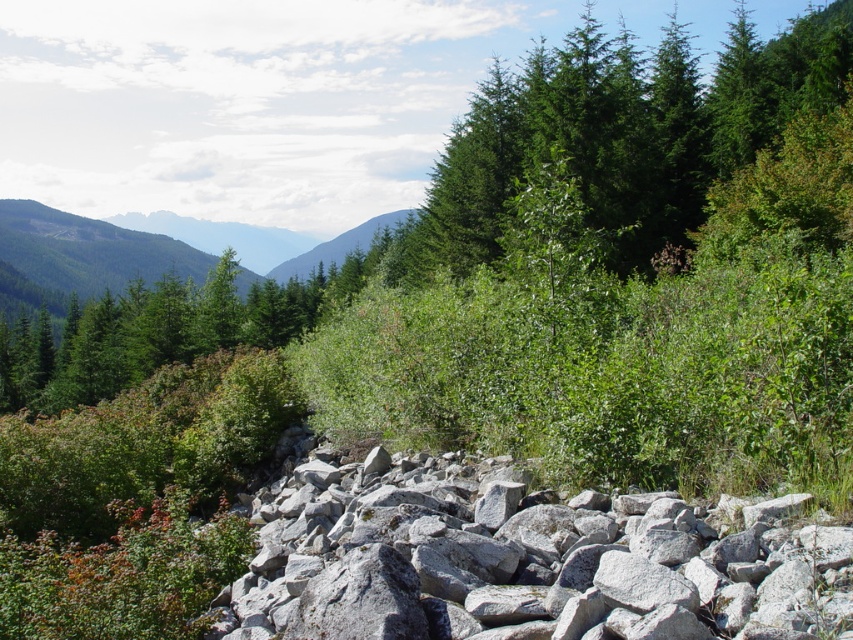
You are standing in the natural landscape described. There are two points marked in the image. Which point, point (490, 493) or point (397, 248), is closer to you?

Point (490, 493) is closer to the viewer than point (397, 248).

You are an environmental scientist assessing the landscape. You need to determine which object occupies more horizontal space in the scene between the green glossy tree at upper right and the green forested mountain at upper left. Based on the scene description, which one is wider?

The green forested mountain at upper left is wider than the green glossy tree at upper right.